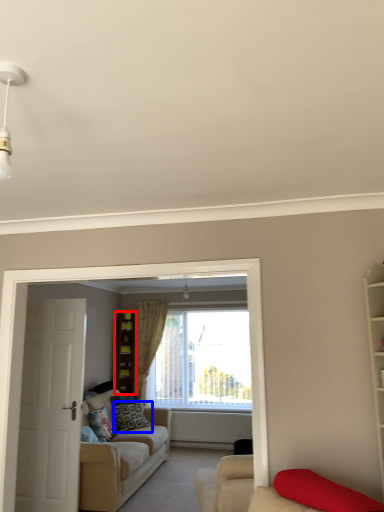
Question: Which object appears farthest to the camera in this image, cabinet (highlighted by a red box) or pillow (highlighted by a blue box)?

Choices:
 (A) cabinet
 (B) pillow

Answer: (A)